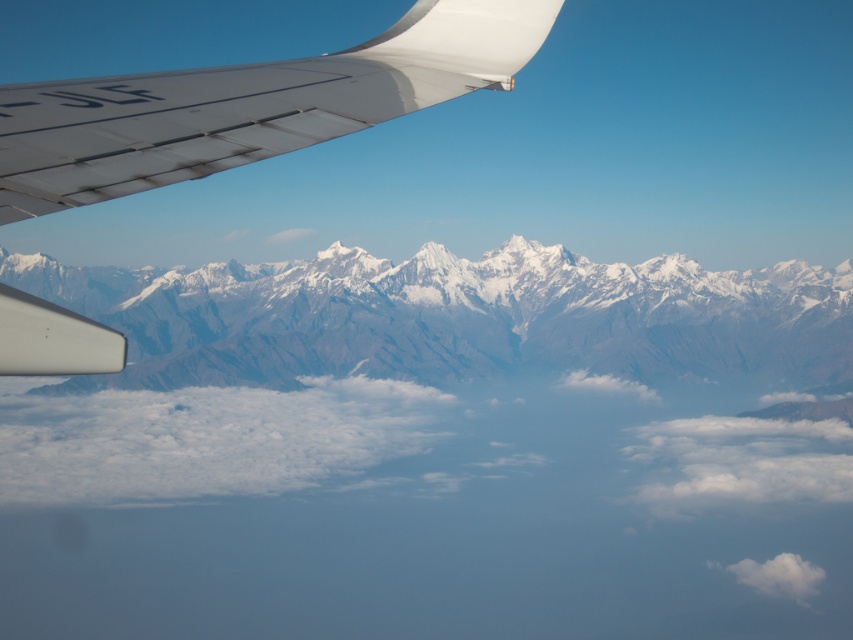
Looking at this image, you are a pilot looking out of the airplane window. You see the matte white wing at upper left and the white fluffy cloud at lower right. Which object is positioned more to the left side of your view?

The matte white wing at upper left is positioned more to the left side of your view than the white fluffy cloud at lower right.

You are a pilot checking the view from the cockpit. You notice the snowy granite mountains at center and the matte white wing at upper left. Which object appears wider from your current viewpoint?

The snowy granite mountains at center might be wider than the matte white wing at upper left according to the description.

You are an airplane passenger looking out the window and see two points in the scene. The first point is at coordinate point (552, 10) and the second is at point (767, 588). Which point is closer to you?

Point (552, 10) is in front of point (767, 588), so it is closer to you.